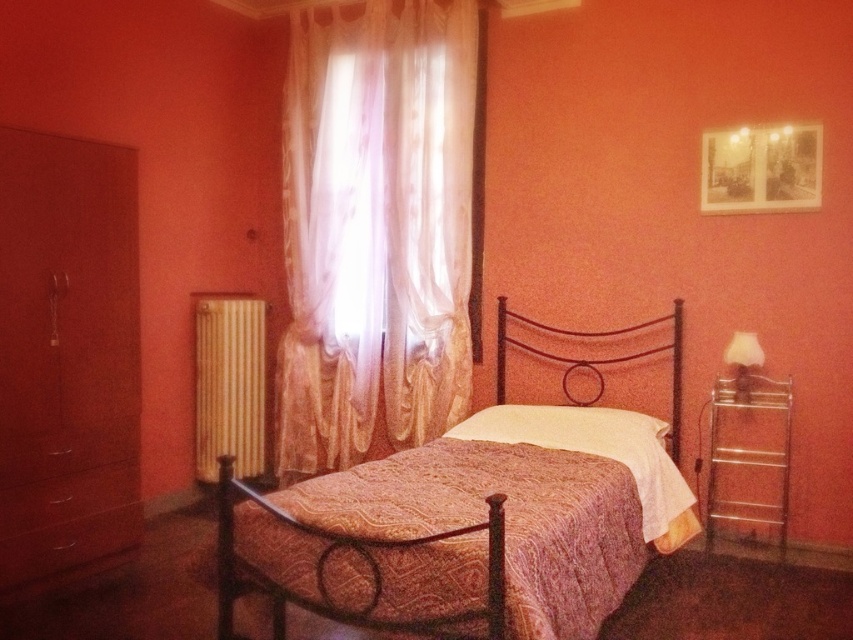
Question: Is the position of matte wood dresser at left more distant than that of matte brown drawer at lower left?

Choices:
 (A) no
 (B) yes

Answer: (A)

Question: Can you confirm if metallic bed at center is positioned to the right of white soft pillow at center?

Choices:
 (A) yes
 (B) no

Answer: (B)

Question: Which is nearer to the matte brown drawer at lower left?

Choices:
 (A) matte wood dresser at left
 (B) metallic bed at center

Answer: (A)

Question: Does metallic gold radiator at left have a smaller size compared to metallic brown headboard at center?

Choices:
 (A) yes
 (B) no

Answer: (A)

Question: Which object is the closest to the sheer white curtain at center?

Choices:
 (A) metallic bed at center
 (B) matte brown drawer at lower left
 (C) white soft pillow at center
 (D) metallic brown headboard at center

Answer: (D)

Question: Estimate the real-world distances between objects in this image. Which object is closer to the sheer white curtain at center?

Choices:
 (A) matte wood dresser at left
 (B) matte brown drawer at lower left

Answer: (A)